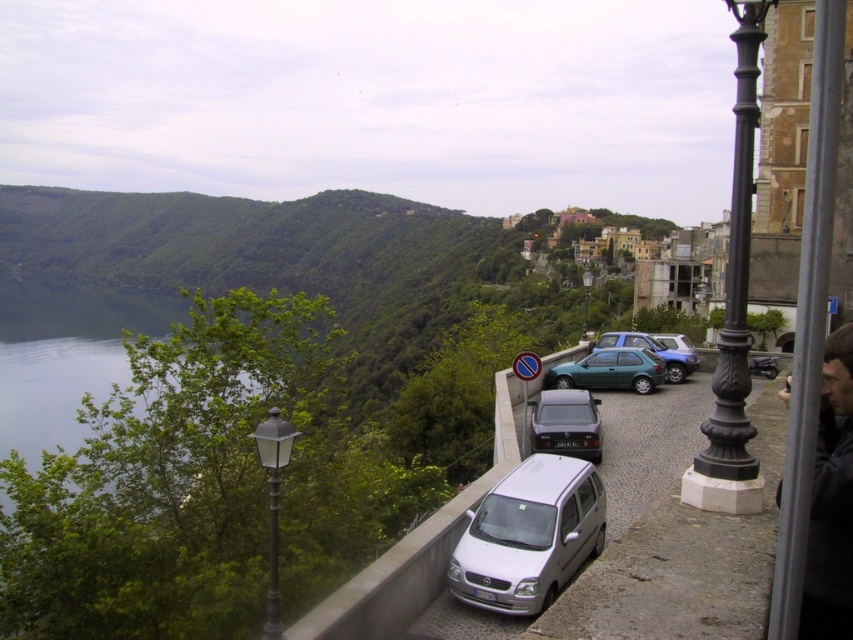
Question: Is white glass lamp post at center-left positioned before black metal lamp post at center?

Choices:
 (A) no
 (B) yes

Answer: (B)

Question: Does black metal pole at right have a larger size compared to metallic blue hatchback at center?

Choices:
 (A) no
 (B) yes

Answer: (B)

Question: Which point is farther to the camera?

Choices:
 (A) (657, 358)
 (B) (650, 349)
 (C) (560, 420)
 (D) (587, 275)

Answer: (D)

Question: Estimate the real-world distances between objects in this image. Which object is farther from the metallic blue hatchback at center?

Choices:
 (A) white glass lamp post at center-left
 (B) metallic gray sedan at center
 (C) black metal pole at right
 (D) metallic green hatchback at center-right

Answer: (A)

Question: Which is nearer to the black metal lamp post at center?

Choices:
 (A) metallic blue hatchback at center
 (B) metallic gray sedan at center

Answer: (A)

Question: Does black metal pole at right appear over white glass lamp post at center-left?

Choices:
 (A) yes
 (B) no

Answer: (A)